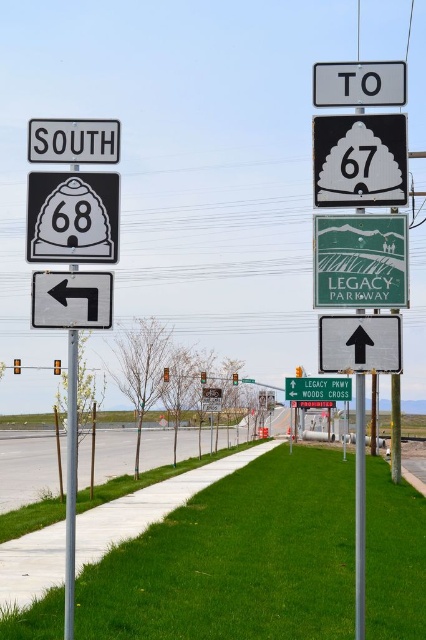
You are a driver approaching the road signs and need to read the text on both the green matte sign at center and the green matte sign at upper center. Which sign will you need to look up at more to read?

The green matte sign at upper center is taller than the green matte sign at center, so you will need to look up more to read the green matte sign at upper center.

What is the spatial relationship between the green matte sign at center and the green matte sign at upper center in the scene?

The green matte sign at center is in front of the green matte sign at upper center, partially obscuring it.